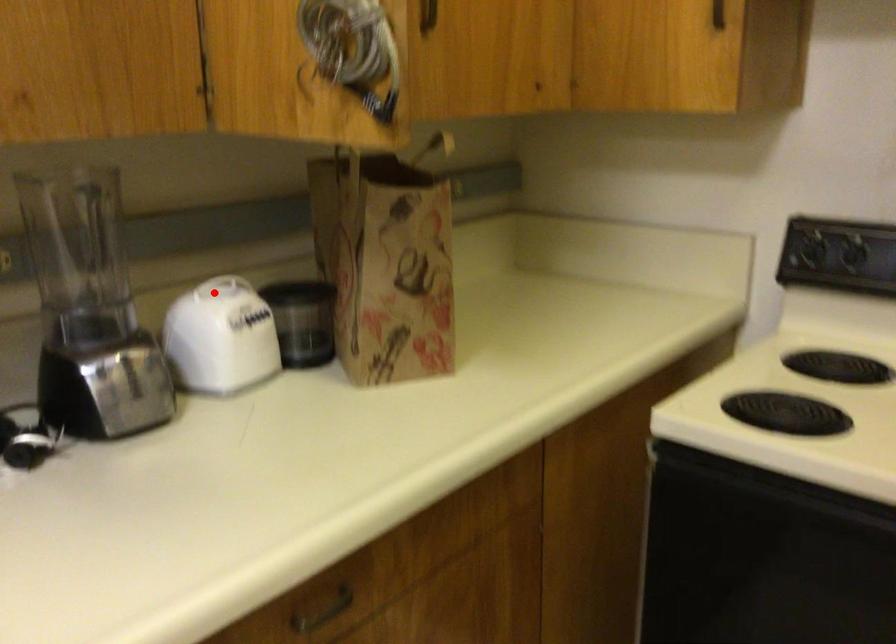
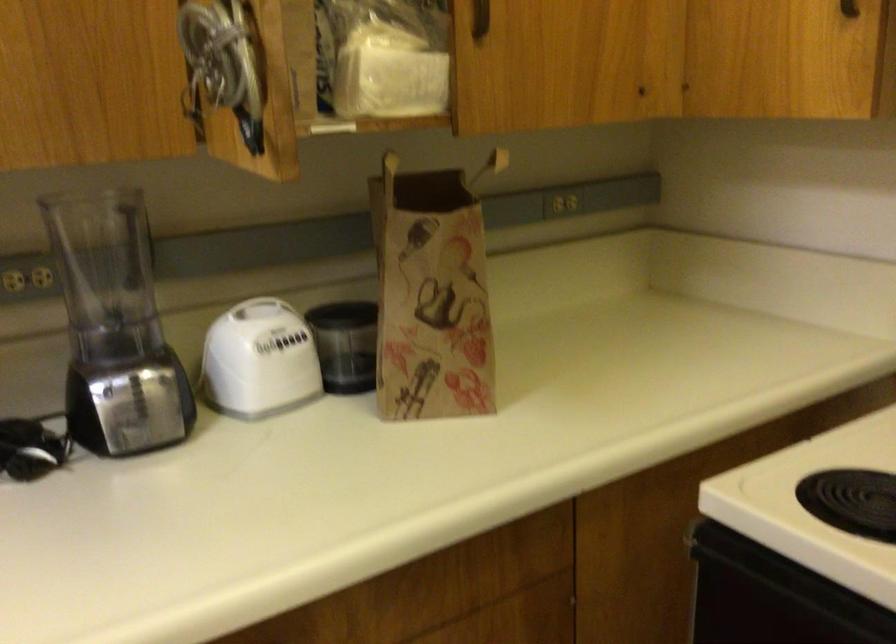
Find the pixel in the second image that matches the highlighted location in the first image.

(260, 308)